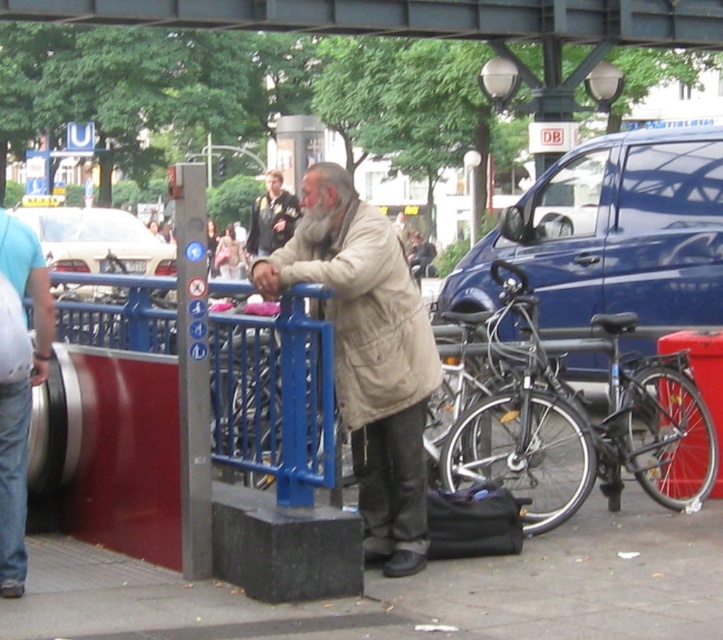
You are a delivery person who needs to park your silver metallic bicycle at center near the subway entrance. There is a metallic blue van at center blocking the path. Can you easily move around the van to reach the entrance?

The metallic blue van at center is further to the viewer than the silver metallic bicycle at center, so the van is closer to you. This means the van is blocking your path, making it difficult to move around it to reach the subway entrance.

You are a tailor who needs to determine which item requires more fabric between the light brown leather jacket at center and the gray matte beard at center. Which one would you prioritize?

The light brown leather jacket at center might be wider than gray matte beard at center, so the tailor should prioritize making the light brown leather jacket at center first since it requires more fabric.

You are a photographer trying to capture the light brown leather jacket at center in your shot. If your camera can only focus on objects within a 0.3 radius from the center point at coordinates 0.5, 0.5, will the jacket be in focus?

The light brown leather jacket at center is located at coordinates (270, 216). The distance from the center point (361, 320) is sqrt of squared differences. Calculating sqrt of squared differences between 0.339 and 0.5 in x and y coordinates. The distance is sqrt of 0.161 squared plus 0.124 squared. That equals sqrt of 0.0259 plus 0.0154, totaling sqrt of 0.0413, which is approximately 0.203. Since 0.203 is less than 0.3, the jacket will be in focus.